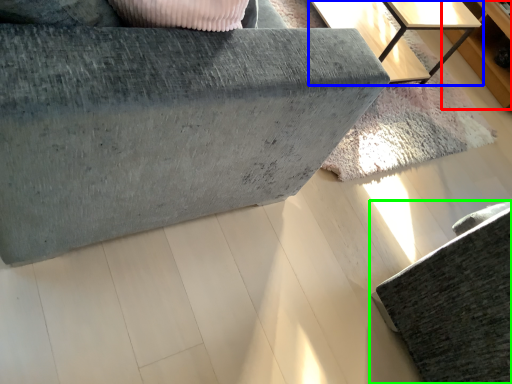
Question: Which object is the closest to the dresser (highlighted by a red box)? Choose among these: table (highlighted by a blue box) or furniture (highlighted by a green box).

Choices:
 (A) table
 (B) furniture

Answer: (A)